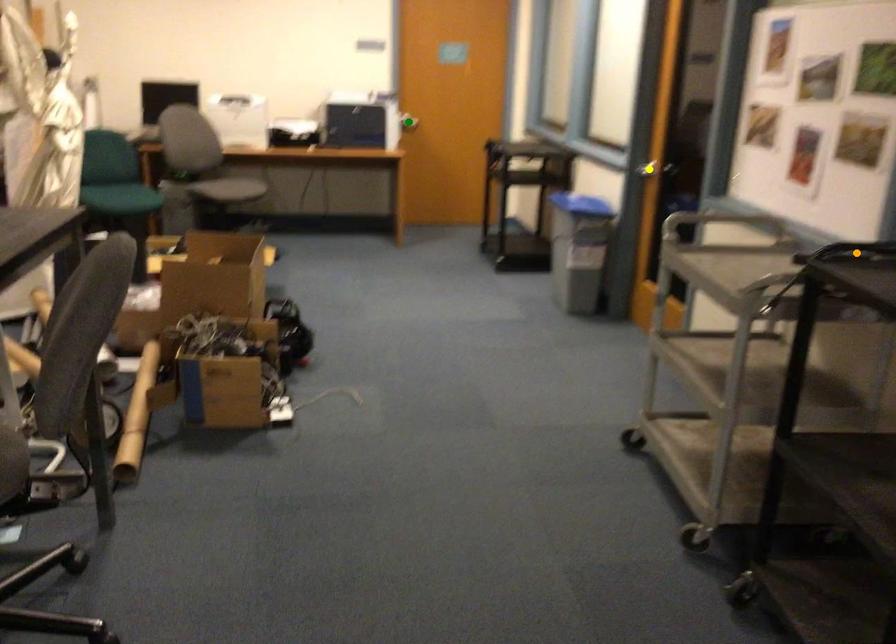
Order these from farthest to nearest:
A) green point
B) yellow point
C) orange point

1. green point
2. yellow point
3. orange point